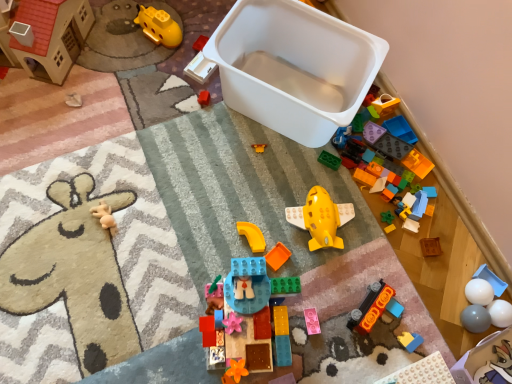
Find the location of a particular element. This screenshot has height=384, width=512. vacant space that is to the left of white glossy ball at lower right, the fifteenth toy in the left-to-right sequence is located at coordinates (418, 284).